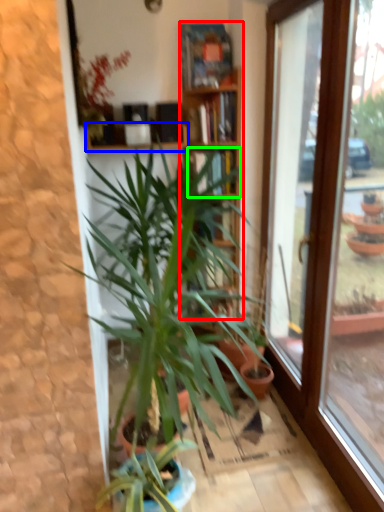
Question: Based on their relative distances, which object is farther from bookcase (highlighted by a red box)? Choose from shelf (highlighted by a blue box) and shelf (highlighted by a green box).

Choices:
 (A) shelf
 (B) shelf

Answer: (A)